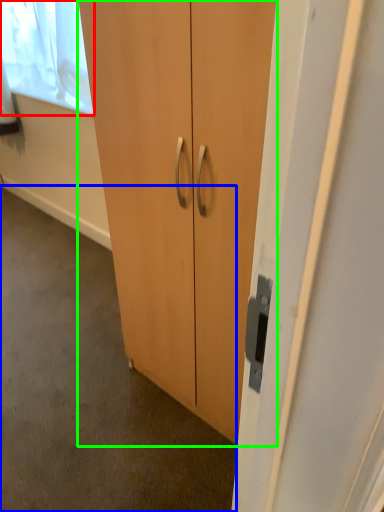
Question: Considering the real-world distances, which object is farthest from window screen (highlighted by a red box)? concrete (highlighted by a blue box) or cupboard (highlighted by a green box)?

Choices:
 (A) concrete
 (B) cupboard

Answer: (B)